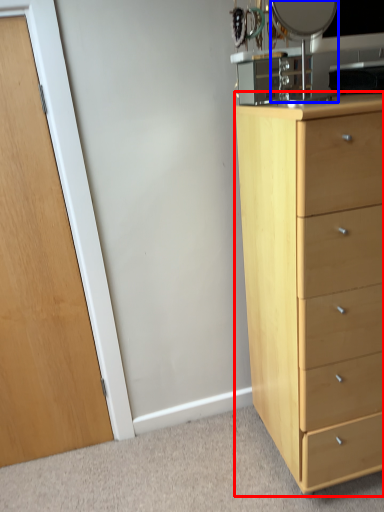
Question: Which object appears farthest to the camera in this image, chest of drawers (highlighted by a red box) or mirror (highlighted by a blue box)?

Choices:
 (A) chest of drawers
 (B) mirror

Answer: (B)